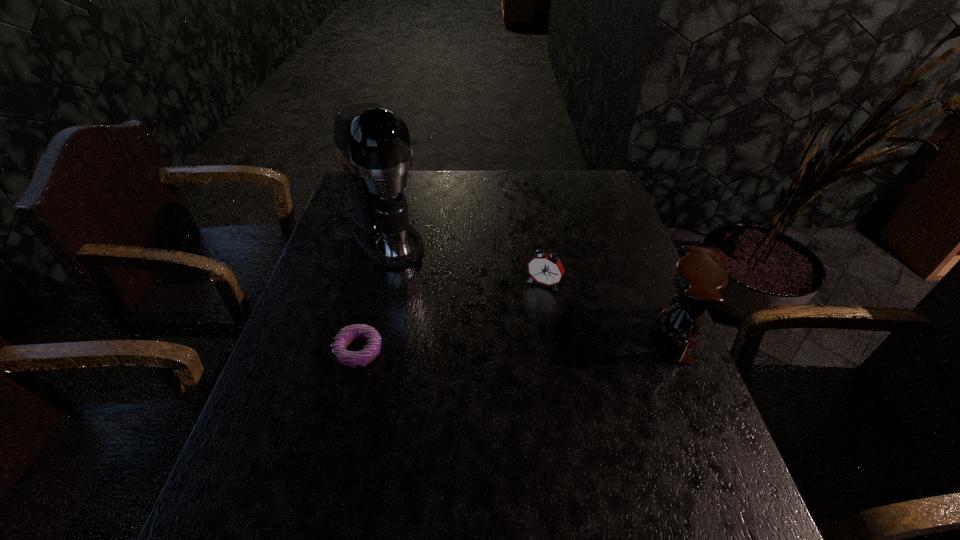
Find the location of `free location located 0.370m place cup under the spout of the farthest object`. free location located 0.370m place cup under the spout of the farthest object is located at coordinates (485, 343).

Locate an element on the screen. Image resolution: width=960 pixels, height=540 pixels. vacant space located 0.380m place cup under the spout of the farthest object is located at coordinates (488, 346).

Locate an element on the screen. free space located 0.090m on the clock face of the second farthest object is located at coordinates (525, 314).

You are a GUI agent. You are given a task and a screenshot of the screen. Output one action in this format:
    pyautogui.click(x=<x>, y=<y>)
    Task: Click on the free region located on the clock face of the second farthest object
    
    Given the screenshot: What is the action you would take?
    click(x=523, y=317)

Where is `vacant space located on the clock face of the second farthest object`? Image resolution: width=960 pixels, height=540 pixels. vacant space located on the clock face of the second farthest object is located at coordinates (491, 379).

Identify the location of doughnut positioned at the left edge. Image resolution: width=960 pixels, height=540 pixels. (349, 359).

At what (x,y) coordinates should I click in order to perform the action: click on coffee maker present at the left edge. Please return your answer as a coordinate pair (x, y). This screenshot has height=540, width=960. Looking at the image, I should click on (373, 143).

Identify the location of object that is positioned at the right edge. The width and height of the screenshot is (960, 540). (698, 280).

Find the location of `free point at the far edge`. free point at the far edge is located at coordinates (429, 202).

At what (x,y) coordinates should I click in order to perform the action: click on free space at the left edge of the desktop. Please return your answer as a coordinate pair (x, y). This screenshot has width=960, height=540. Looking at the image, I should click on (339, 215).